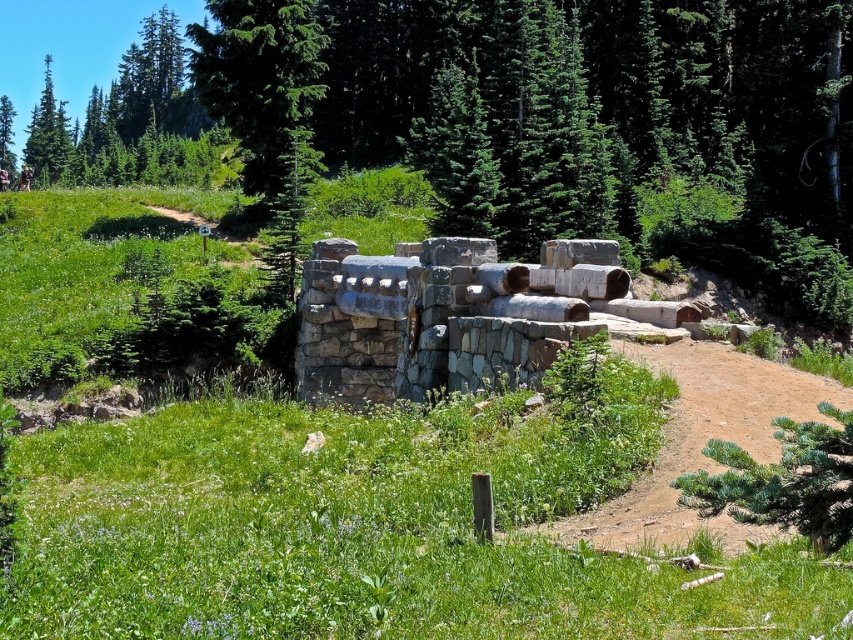
From the picture: Is the position of green coniferous tree at upper left less distant than that of green textured tree at upper left?

Yes, green coniferous tree at upper left is closer to the viewer.

Does green coniferous tree at upper left appear over green textured tree at upper left?

Incorrect, green coniferous tree at upper left is not positioned above green textured tree at upper left.

Which is behind, point (248, 64) or point (67, 145)?

The point (67, 145) is behind.

Image resolution: width=853 pixels, height=640 pixels. What are the coordinates of `green coniferous tree at upper left` in the screenshot? It's located at (259, 77).